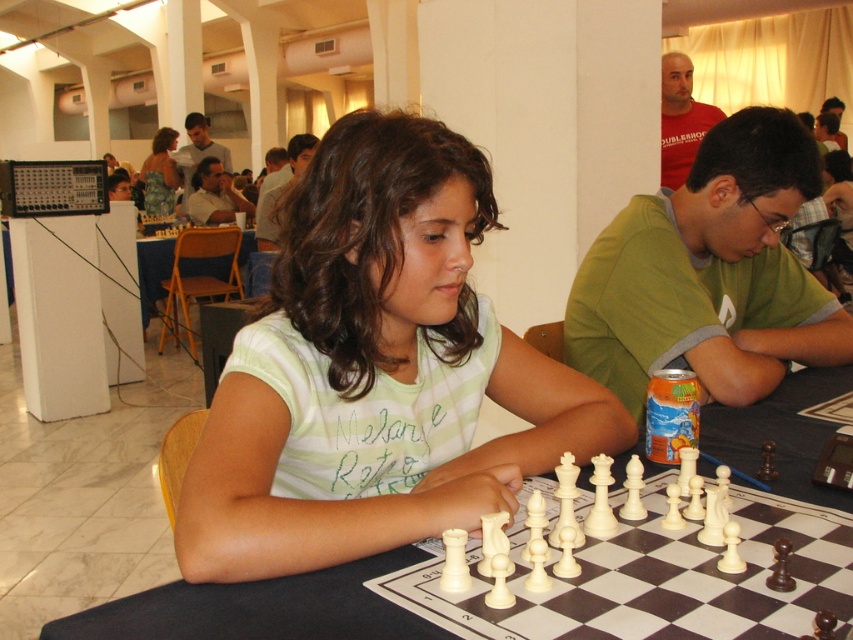
Question: Does green fabric shirt at center have a smaller size compared to matte gray shirt at center?

Choices:
 (A) yes
 (B) no

Answer: (A)

Question: Is matte green shirt at center to the right of smooth brown shirt at center from the viewer's perspective?

Choices:
 (A) no
 (B) yes

Answer: (B)

Question: Which point is farther to the camera?

Choices:
 (A) white plastic chessboard at center
 (B) white plastic chess pieces at center

Answer: (A)

Question: Does green striped shirt at center have a smaller size compared to green fabric shirt at center?

Choices:
 (A) yes
 (B) no

Answer: (A)

Question: Among these points, which one is farthest from the camera?

Choices:
 (A) (294, 150)
 (B) (146, 211)

Answer: (B)

Question: Which point is closer to the camera taking this photo?

Choices:
 (A) (679, 138)
 (B) (776, 438)
 (C) (178, 164)
 (D) (282, 152)

Answer: (B)